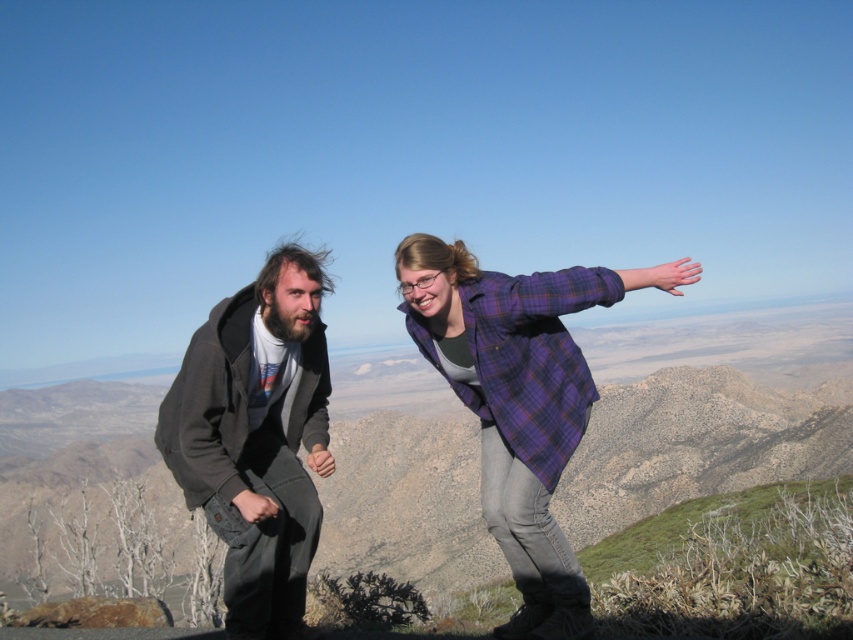
Looking at this image, you are standing at point point (473, 332) and want to take a photo of the two people in the scene. If the camera you are using has a maximum range of 80 feet, will you be able to capture them clearly?

The point (473, 332) and camera are 82.15 feet apart from each other, which exceeds the camera maximum range of 80 feet. Therefore, you won not be able to capture them clearly.

Based on the scene description, where is the purple flannel shirt at center located in terms of its 2D coordinates?

The purple flannel shirt at center is located at the 2D coordinates of point (x=519, y=401).